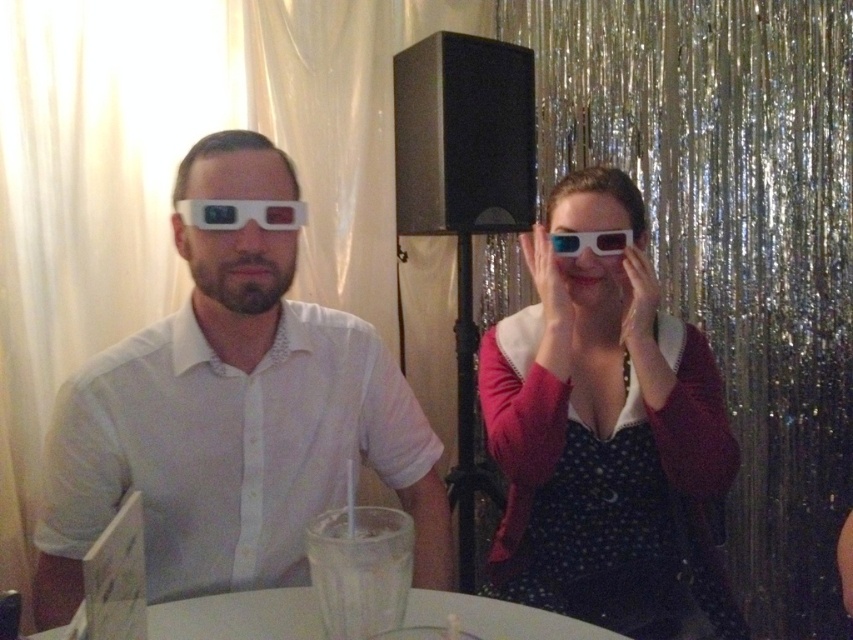
Does white plastic goggles at center come behind matte plastic goggles at center?

No, white plastic goggles at center is closer to the viewer.

This screenshot has width=853, height=640. Describe the element at coordinates (241, 212) in the screenshot. I see `white plastic goggles at center` at that location.

Image resolution: width=853 pixels, height=640 pixels. Find the location of `white plastic goggles at center`. white plastic goggles at center is located at coordinates (241, 212).

Does white glossy table at center have a lesser width compared to white plastic goggles at center?

Answer: Incorrect, white glossy table at center's width is not less than white plastic goggles at center's.

In the scene shown: Is white glossy table at center below white plastic goggles at center?

Correct, white glossy table at center is located below white plastic goggles at center.

Image resolution: width=853 pixels, height=640 pixels. Find the location of `white glossy table at center`. white glossy table at center is located at coordinates (239, 616).

Between point (262, 422) and point (264, 624), which one is positioned in front?

Positioned in front is point (264, 624).

Is white matte 3d glasses at left positioned in front of white glossy table at center?

No, it is behind white glossy table at center.

Who is more forward, (178,472) or (425,602)?

Point (425,602) is more forward.

This screenshot has height=640, width=853. In order to click on white matte 3d glasses at left in this screenshot , I will do `click(231, 433)`.